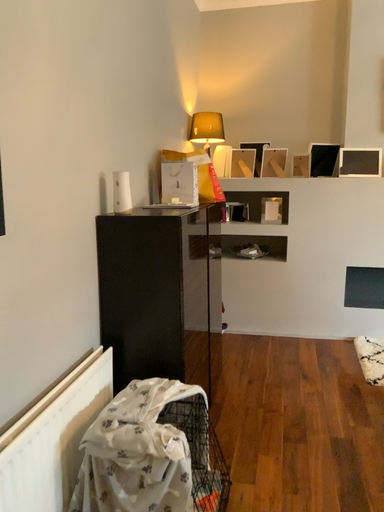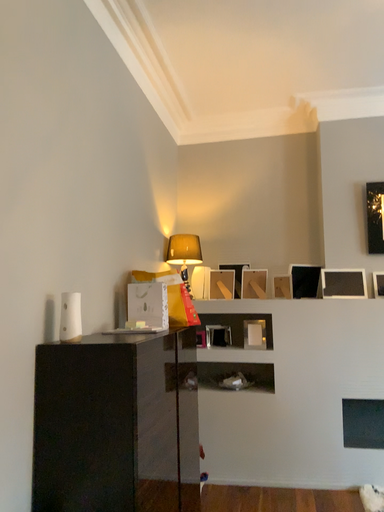
Question: How did the camera likely rotate when shooting the video?

Choices:
 (A) rotated upward
 (B) rotated downward

Answer: (A)